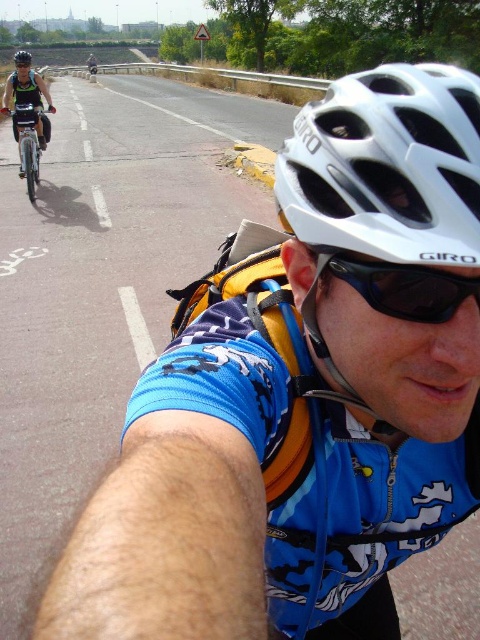
Question: Can you confirm if white matte helmet at center is bigger than matte black helmet at upper center?

Choices:
 (A) no
 (B) yes

Answer: (A)

Question: Which point is farther to the camera?

Choices:
 (A) silver metallic bicycle at left
 (B) matte black helmet at upper center

Answer: (B)

Question: From the image, what is the correct spatial relationship of black plastic sunglasses at center in relation to matte black helmet at upper center?

Choices:
 (A) below
 (B) above

Answer: (A)

Question: Which is farther from the silver metallic bicycle at left?

Choices:
 (A) matte black helmet at upper left
 (B) white matte helmet at center
 (C) matte black bicycle at upper left

Answer: (C)

Question: Is matte black helmet at upper left in front of matte black bicycle at upper left?

Choices:
 (A) no
 (B) yes

Answer: (B)

Question: Which object is closer to the camera taking this photo?

Choices:
 (A) white matte helmet at center
 (B) matte black helmet at upper left

Answer: (A)